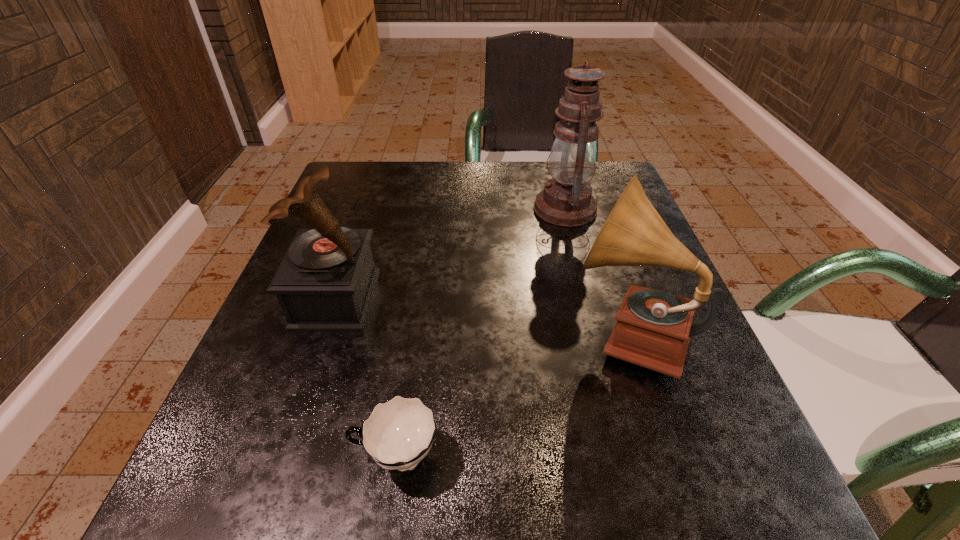
Where is `free space in the image that satisfies the following two spatial constraints: 1. on the side of the second object from left to right with the handle; 2. on the right side of the tallest object`? This screenshot has width=960, height=540. free space in the image that satisfies the following two spatial constraints: 1. on the side of the second object from left to right with the handle; 2. on the right side of the tallest object is located at coordinates (432, 209).

Locate an element on the screen. This screenshot has width=960, height=540. vacant area that satisfies the following two spatial constraints: 1. at the horn opening of the left phonograph_record; 2. on the side of the second object from left to right with the handle is located at coordinates (281, 457).

I want to click on vacant space that satisfies the following two spatial constraints: 1. on the side of the cup with the handle; 2. at the horn opening of the leftmost object, so click(420, 299).

In order to click on blank area in the image that satisfies the following two spatial constraints: 1. on the side of the shortest object with the handle; 2. at the horn opening of the left phonograph_record in this screenshot , I will do `click(420, 299)`.

Find the location of a particular element. The height and width of the screenshot is (540, 960). free location that satisfies the following two spatial constraints: 1. at the horn opening of the left phonograph_record; 2. on the side of the second object from left to right with the handle is located at coordinates (281, 457).